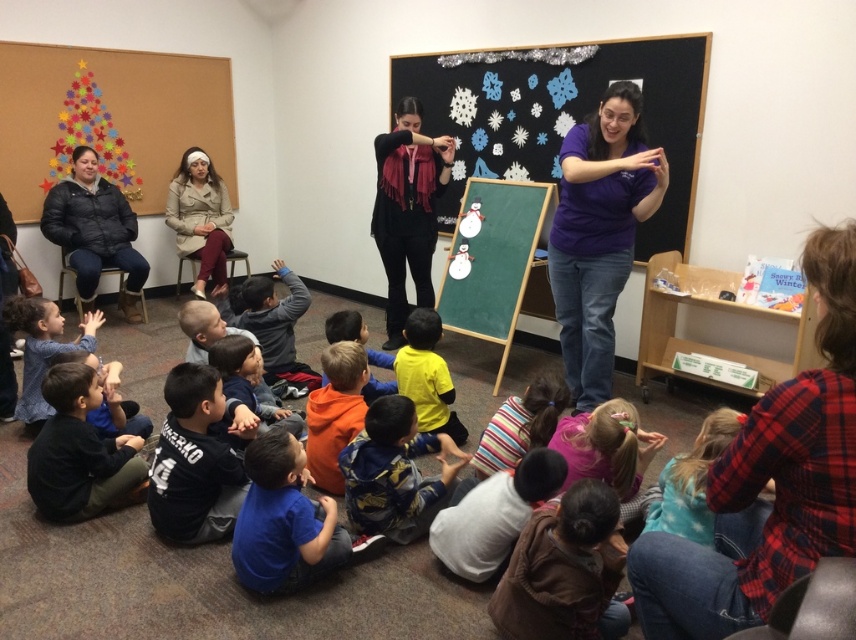
Can you confirm if matte black chalkboard with snowflakes at upper center is positioned to the left of yellow matte shirt at center?

No, matte black chalkboard with snowflakes at upper center is not to the left of yellow matte shirt at center.

Does matte black chalkboard with snowflakes at upper center have a greater height compared to yellow matte shirt at center?

Yes.

Is point (516, 122) in front of point (418, 406)?

No, (516, 122) is further to viewer.

In order to click on matte black chalkboard with snowflakes at upper center in this screenshot , I will do `click(562, 113)`.

Does brown fuzzy jacket at lower right appear over black matte scarf at center?

No, brown fuzzy jacket at lower right is not above black matte scarf at center.

Is point (599, 518) farther from viewer compared to point (414, 209)?

That is False.

This screenshot has height=640, width=856. What are the coordinates of `brown fuzzy jacket at lower right` in the screenshot? It's located at (563, 570).

The width and height of the screenshot is (856, 640). What are the coordinates of `brown fuzzy jacket at lower right` in the screenshot? It's located at click(x=563, y=570).

Which is in front, point (348, 506) or point (437, 387)?

Positioned in front is point (348, 506).

Is point (384, 488) less distant than point (400, 348)?

Yes.

In order to click on blue cotton shirt at center in this screenshot , I will do `click(394, 472)`.

At what (x,y) coordinates should I click in order to perform the action: click on blue cotton shirt at center. Please return your answer as a coordinate pair (x, y). Image resolution: width=856 pixels, height=640 pixels. Looking at the image, I should click on (394, 472).